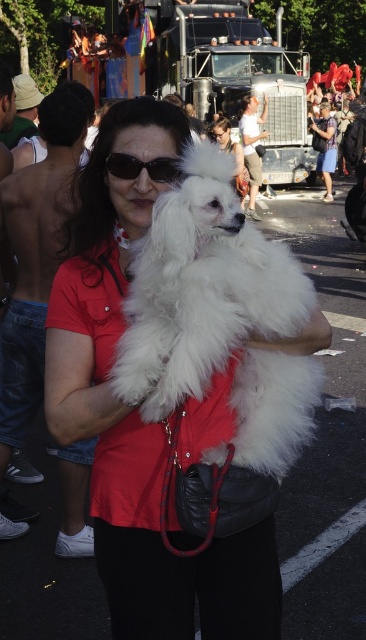
Question: Is white fluffy dog at center positioned before matte black dog at center?

Choices:
 (A) no
 (B) yes

Answer: (B)

Question: Can you confirm if white fluffy dog at center is positioned below matte black dog at center?

Choices:
 (A) no
 (B) yes

Answer: (B)

Question: Which object appears closest to the camera in this image?

Choices:
 (A) matte red shirt at center
 (B) white fluffy dog at center
 (C) matte black dog at center

Answer: (B)

Question: Which point is closer to the camera?

Choices:
 (A) (87, 193)
 (B) (218, 134)
 (C) (128, 376)

Answer: (C)

Question: Which object is the farthest from the white fluffy dog at center?

Choices:
 (A) matte black dog at center
 (B) matte red shirt at center
 (C) black plastic sunglasses at center

Answer: (A)

Question: Is white fluffy dog at center to the left of matte black dog at center from the viewer's perspective?

Choices:
 (A) no
 (B) yes

Answer: (B)